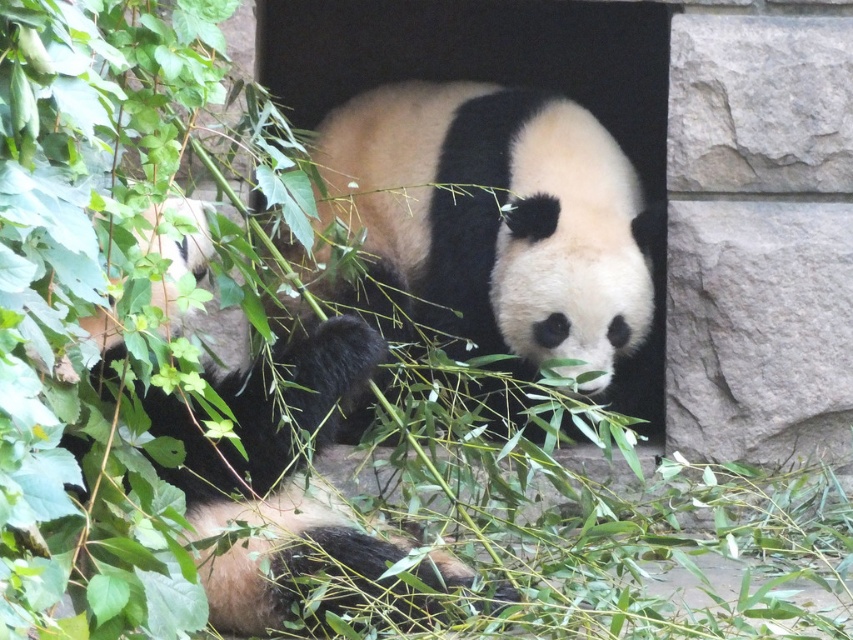
Who is positioned more to the right, black fuzzy panda at center or black and white fur panda at center?

From the viewer's perspective, black fuzzy panda at center appears more on the right side.

Which is in front, point (543, 140) or point (248, 380)?

Point (248, 380)

I want to click on black fuzzy panda at center, so click(491, 224).